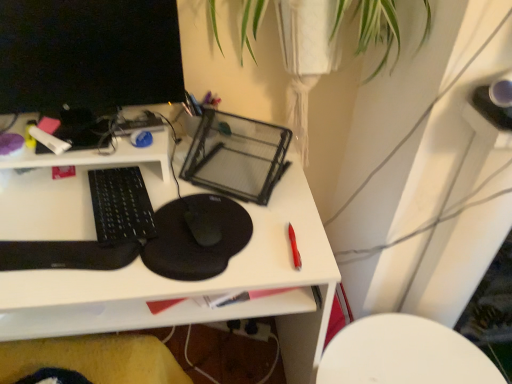
Locate an element on the screen. The image size is (512, 384). vacant area situated below black matte mousepad at center (from a real-world perspective) is located at coordinates (200, 225).